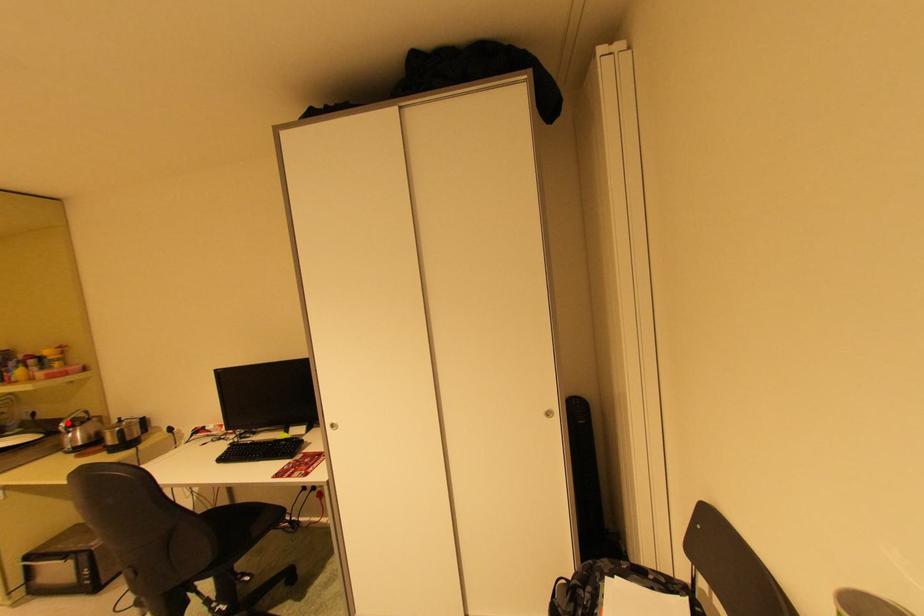
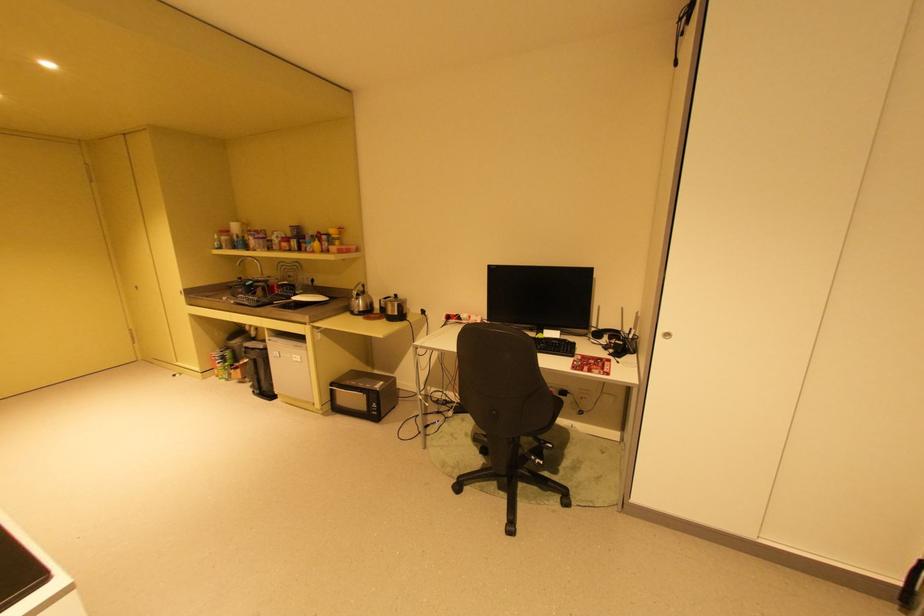
Locate, in the second image, the point that corresponds to the highlighted location in the first image.

(359, 290)